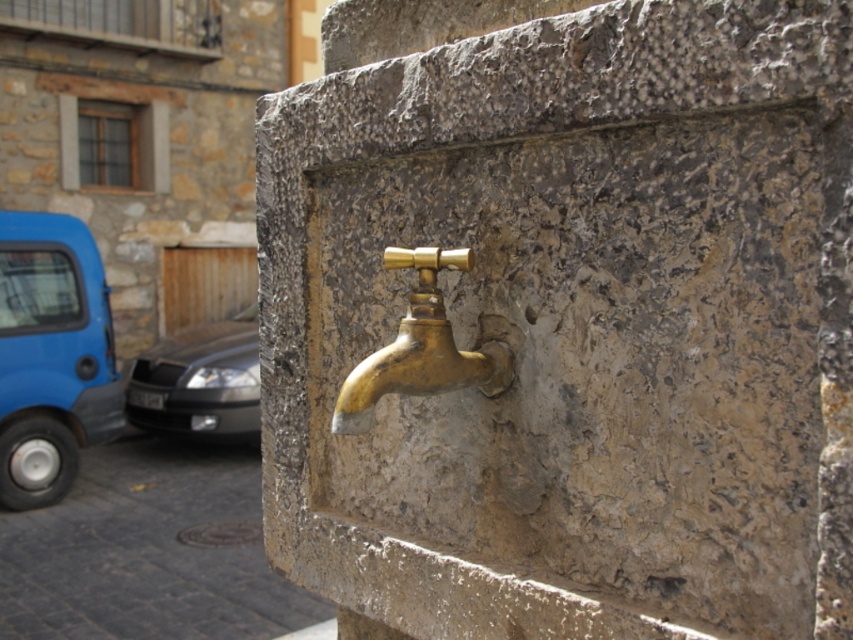
Question: From the image, what is the correct spatial relationship of gold brass faucet at center in relation to silver metallic car at left?

Choices:
 (A) left
 (B) right

Answer: (B)

Question: Is gold-bronze faucet at center positioned behind silver metallic car at left?

Choices:
 (A) yes
 (B) no

Answer: (B)

Question: Which point is farther to the camera?

Choices:
 (A) silver metallic car at left
 (B) gold-bronze faucet at center

Answer: (A)

Question: Is blue rubber car at left positioned in front of silver metallic car at left?

Choices:
 (A) yes
 (B) no

Answer: (A)

Question: Based on their relative distances, which object is farther from the gold-bronze faucet at center?

Choices:
 (A) silver metallic car at left
 (B) blue rubber car at left
 (C) gold brass faucet at center

Answer: (A)

Question: Which is nearer to the blue rubber car at left?

Choices:
 (A) gold-bronze faucet at center
 (B) gold brass faucet at center

Answer: (A)